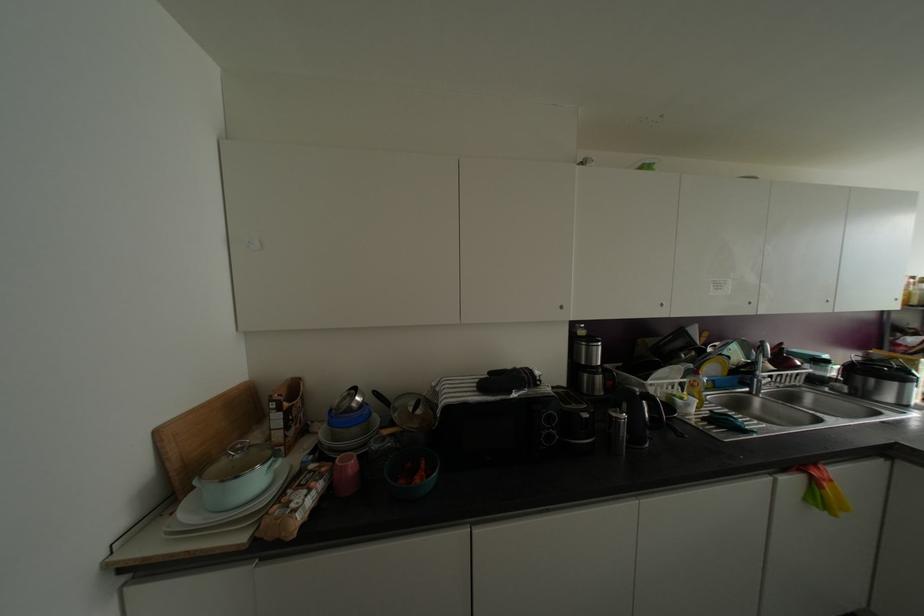
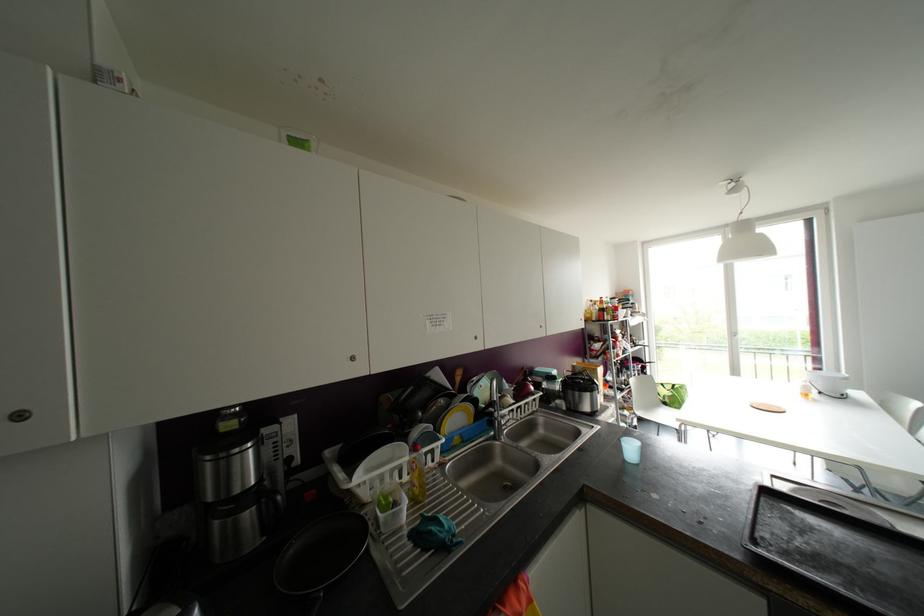
Where in the second image is the point corresponding to [561,307] from the first image?

(19, 416)